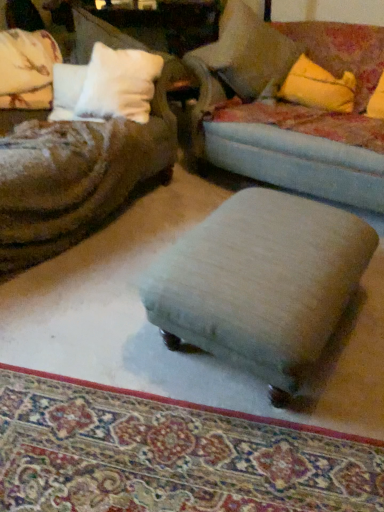
This screenshot has width=384, height=512. Find the location of `free location above beige fabric ottoman at center (from a real-world perspective)`. free location above beige fabric ottoman at center (from a real-world perspective) is located at coordinates (171, 449).